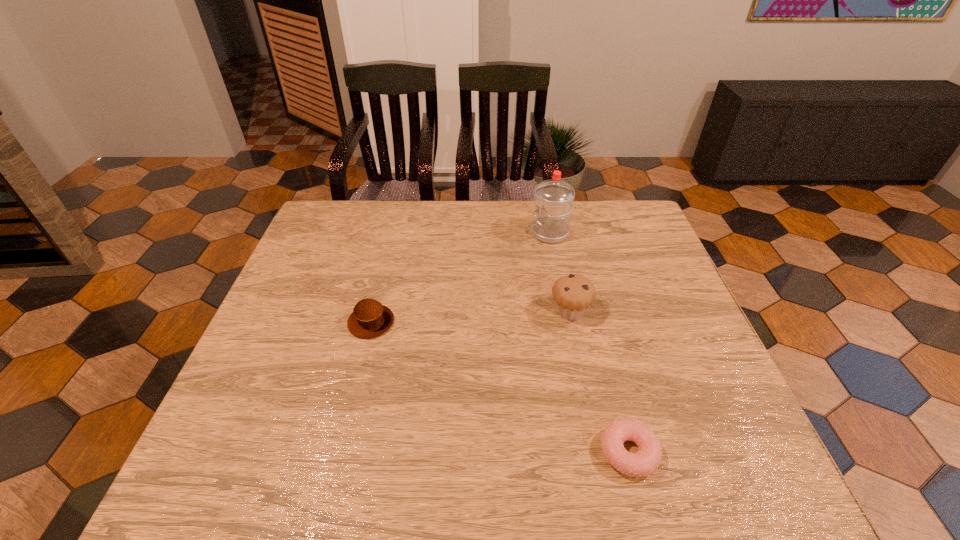
You are a GUI agent. You are given a task and a screenshot of the screen. Output one action in this format:
    pyautogui.click(x=<x>, y=<y>)
    Task: Click on the blank area in the image that satisfies the following two spatial constraints: 1. on the handle side of the third shortest object; 2. on the right side of the tallest object
    
    Given the screenshot: What is the action you would take?
    pyautogui.click(x=565, y=312)